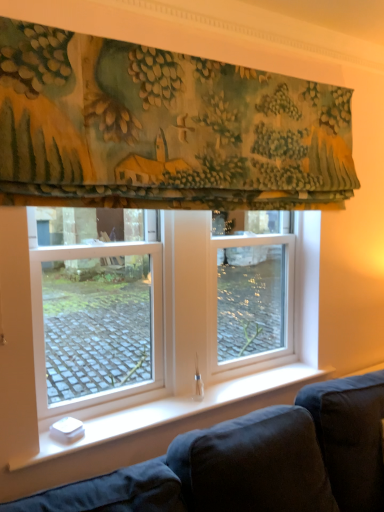
Question: From the image's perspective, does textured green fabric at upper center appear higher than dark blue fabric couch at lower left?

Choices:
 (A) yes
 (B) no

Answer: (A)

Question: Considering the relative sizes of textured green fabric at upper center and dark blue fabric couch at lower left in the image provided, is textured green fabric at upper center bigger than dark blue fabric couch at lower left?

Choices:
 (A) yes
 (B) no

Answer: (A)

Question: Is textured green fabric at upper center to the right of dark blue fabric couch at lower left from the viewer's perspective?

Choices:
 (A) yes
 (B) no

Answer: (A)

Question: Is textured green fabric at upper center turned away from dark blue fabric couch at lower left?

Choices:
 (A) yes
 (B) no

Answer: (B)

Question: From the image's perspective, is textured green fabric at upper center under dark blue fabric couch at lower left?

Choices:
 (A) no
 (B) yes

Answer: (A)

Question: Considering the relative positions of clear glass window at center and textured green fabric at upper center in the image provided, is clear glass window at center to the left or to the right of textured green fabric at upper center?

Choices:
 (A) left
 (B) right

Answer: (A)

Question: Looking at their shapes, would you say clear glass window at center is wider or thinner than textured green fabric at upper center?

Choices:
 (A) thin
 (B) wide

Answer: (A)

Question: Would you say clear glass window at center is inside or outside textured green fabric at upper center?

Choices:
 (A) outside
 (B) inside

Answer: (A)

Question: Considering the positions of clear glass window at center and textured green fabric at upper center in the image, is clear glass window at center taller or shorter than textured green fabric at upper center?

Choices:
 (A) tall
 (B) short

Answer: (A)

Question: Is dark blue fabric couch at lower left taller or shorter than clear glass window at center?

Choices:
 (A) short
 (B) tall

Answer: (A)

Question: Is point (264, 412) closer or farther from the camera than point (59, 215)?

Choices:
 (A) closer
 (B) farther

Answer: (A)

Question: Based on their sizes in the image, would you say dark blue fabric couch at lower left is bigger or smaller than clear glass window at center?

Choices:
 (A) small
 (B) big

Answer: (A)

Question: Is dark blue fabric couch at lower left to the left or to the right of clear glass window at center in the image?

Choices:
 (A) left
 (B) right

Answer: (B)

Question: Is textured green fabric at upper center in front of or behind dark blue fabric couch at lower left in the image?

Choices:
 (A) front
 (B) behind

Answer: (A)

Question: Based on their positions, is textured green fabric at upper center located to the left or right of dark blue fabric couch at lower left?

Choices:
 (A) left
 (B) right

Answer: (B)